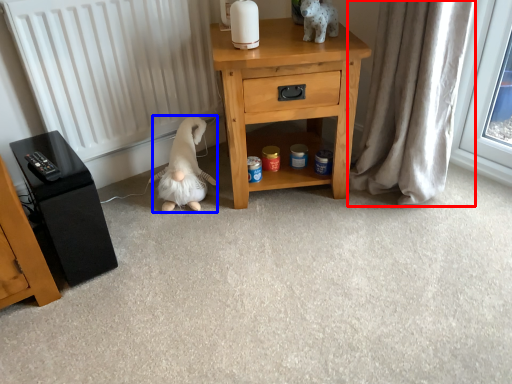
Question: Which of the following is the farthest to the observer, curtain (highlighted by a red box) or animal (highlighted by a blue box)?

Choices:
 (A) curtain
 (B) animal

Answer: (B)